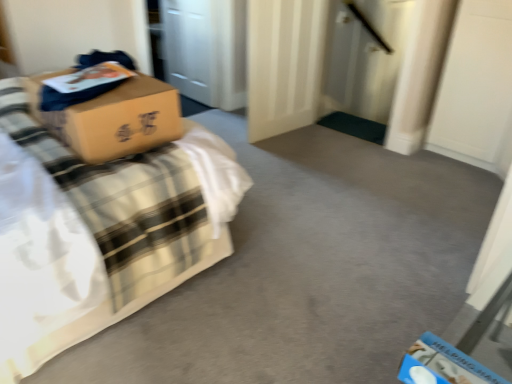
Where is `white matte door at center`? The image size is (512, 384). white matte door at center is located at coordinates (284, 64).

The width and height of the screenshot is (512, 384). What do you see at coordinates (284, 64) in the screenshot? I see `white matte door at center` at bounding box center [284, 64].

From the picture: In order to face matte cardboard box at upper left, should I rotate leftwards or rightwards?

It's best to rotate left around 25.472 degrees.

The width and height of the screenshot is (512, 384). What do you see at coordinates (110, 233) in the screenshot? I see `matte cardboard box at upper left` at bounding box center [110, 233].

Where is `matte cardboard box at upper left`? The image size is (512, 384). matte cardboard box at upper left is located at coordinates 110,233.

I want to click on white matte door at center, so click(x=284, y=64).

Which object is positioned more to the left, matte cardboard box at upper left or white matte door at center?

Positioned to the left is matte cardboard box at upper left.

Considering the positions of objects matte cardboard box at upper left and white matte door at center in the image provided, who is in front, matte cardboard box at upper left or white matte door at center?

matte cardboard box at upper left.

Is point (176, 211) positioned in front of point (298, 58)?

Yes, it is in front of point (298, 58).

From the image's perspective, between matte cardboard box at upper left and white matte door at center, who is located below?

matte cardboard box at upper left.

From a real-world perspective, is matte cardboard box at upper left over white matte door at center?

Indeed, from a real-world perspective, matte cardboard box at upper left stands above white matte door at center.

Considering the sizes of matte cardboard box at upper left and white matte door at center in the image, is matte cardboard box at upper left wider or thinner than white matte door at center?

In the image, matte cardboard box at upper left appears to be wider than white matte door at center.

Can you confirm if matte cardboard box at upper left is taller than white matte door at center?

Correct, matte cardboard box at upper left is much taller as white matte door at center.

Considering the sizes of matte cardboard box at upper left and white matte door at center in the image, is matte cardboard box at upper left bigger or smaller than white matte door at center?

In the image, matte cardboard box at upper left appears to be larger than white matte door at center.

Do you think matte cardboard box at upper left is within white matte door at center, or outside of it?

matte cardboard box at upper left lies outside white matte door at center.

Are matte cardboard box at upper left and white matte door at center far apart?

Indeed, matte cardboard box at upper left is not near white matte door at center.

Is matte cardboard box at upper left oriented towards white matte door at center?

Yes, matte cardboard box at upper left is facing white matte door at center.

Measure the distance between matte cardboard box at upper left and white matte door at center.

They are 1.69 meters apart.

Image resolution: width=512 pixels, height=384 pixels. There is a white matte door at center. In order to click on bed above it (from a real-world perspective) in this screenshot , I will do `click(110, 233)`.

Which is more to the left, white matte door at center or matte cardboard box at upper left?

matte cardboard box at upper left.

Is white matte door at center behind matte cardboard box at upper left?

That is True.

Between point (308, 22) and point (197, 224), which one is positioned behind?

The point (308, 22) is behind.

From the image's perspective, is white matte door at center above matte cardboard box at upper left?

Correct, white matte door at center appears higher than matte cardboard box at upper left in the image.

From a real-world perspective, is white matte door at center under matte cardboard box at upper left?

Yes.

Considering the relative sizes of white matte door at center and matte cardboard box at upper left in the image provided, is white matte door at center wider than matte cardboard box at upper left?

No, white matte door at center is not wider than matte cardboard box at upper left.

From their relative heights in the image, would you say white matte door at center is taller or shorter than matte cardboard box at upper left?

white matte door at center is shorter than matte cardboard box at upper left.

Can you confirm if white matte door at center is smaller than matte cardboard box at upper left?

Yes.

Can we say white matte door at center lies outside matte cardboard box at upper left?

white matte door at center is positioned outside matte cardboard box at upper left.

Is white matte door at center directly adjacent to matte cardboard box at upper left?

No.

Could you tell me if white matte door at center is turned towards matte cardboard box at upper left?

No, white matte door at center is not oriented towards matte cardboard box at upper left.

What's the angular difference between white matte door at center and matte cardboard box at upper left's facing directions?

The facing directions of white matte door at center and matte cardboard box at upper left are 95.5 degrees apart.

How much distance is there between white matte door at center and matte cardboard box at upper left?

They are 1.69 meters apart.

Locate an element on the screen. This screenshot has width=512, height=384. bed below the white matte door at center (from the image's perspective) is located at coordinates (110, 233).

This screenshot has height=384, width=512. I want to click on bed below the white matte door at center (from the image's perspective), so click(110, 233).

Locate an element on the screen. The image size is (512, 384). door behind the matte cardboard box at upper left is located at coordinates (284, 64).